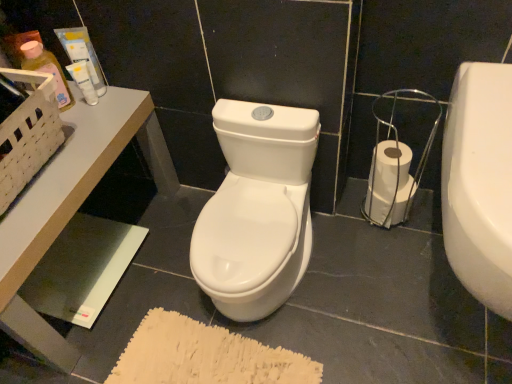
Where is `vacant space in front of translucent plastic bottle at upper left, acting as the third toiletry starting from the right`? vacant space in front of translucent plastic bottle at upper left, acting as the third toiletry starting from the right is located at coordinates (67, 156).